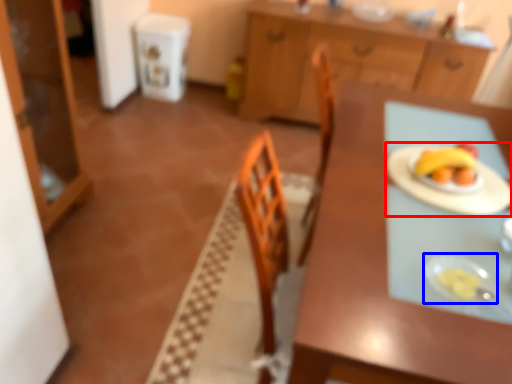
Question: Which object appears farthest to the camera in this image, paper plate (highlighted by a red box) or tableware (highlighted by a blue box)?

Choices:
 (A) paper plate
 (B) tableware

Answer: (A)